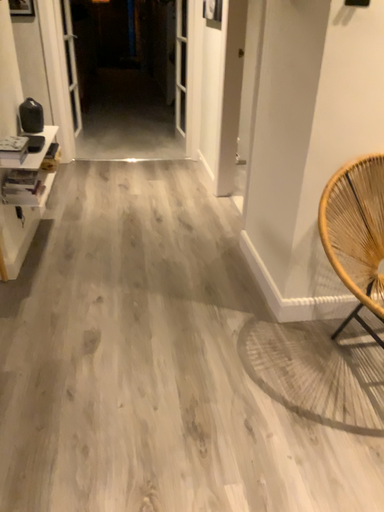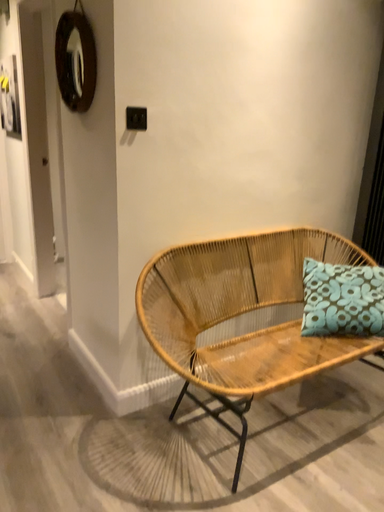
Question: Which way did the camera rotate in the video?

Choices:
 (A) rotated left
 (B) rotated right

Answer: (B)